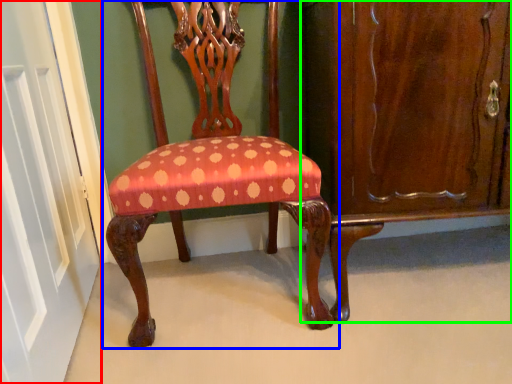
Question: Which object is positioned closest to door (highlighted by a red box)? Select from chair (highlighted by a blue box) and dresser (highlighted by a green box).

Choices:
 (A) chair
 (B) dresser

Answer: (A)